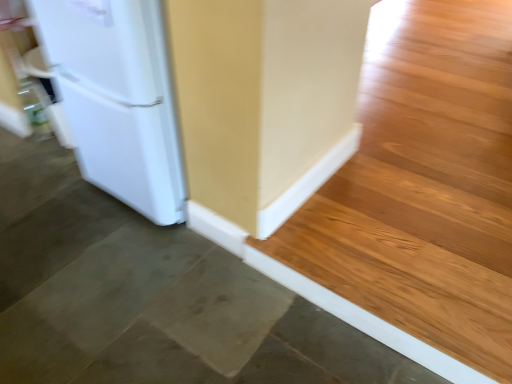
In order to face white matte refrigerator at left, should I rotate leftwards or rightwards?

You should rotate left by 12.900 degrees.

Identify the location of white matte refrigerator at left. (117, 98).

What do you see at coordinates (117, 98) in the screenshot?
I see `white matte refrigerator at left` at bounding box center [117, 98].

Locate an element on the screen. white matte refrigerator at left is located at coordinates (117, 98).